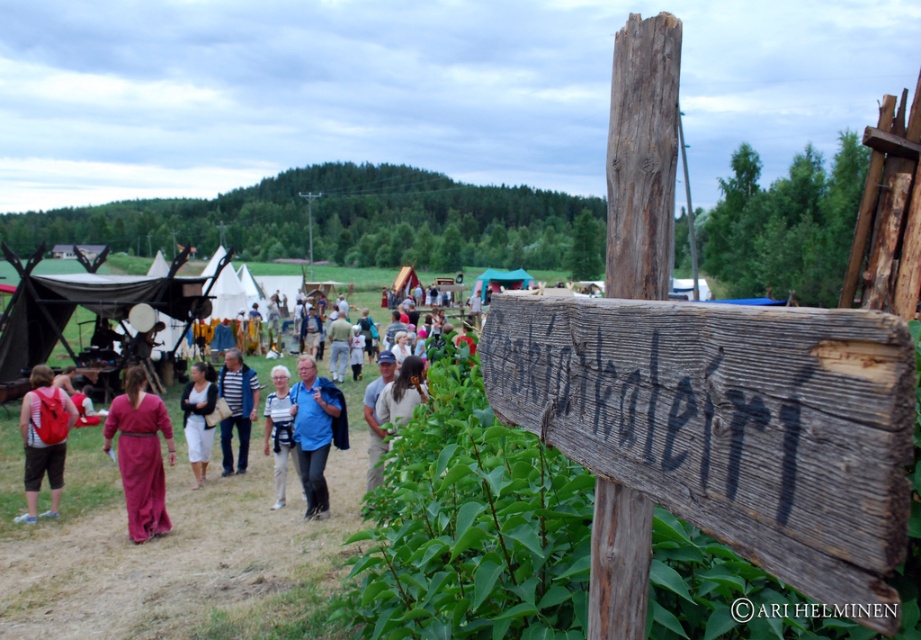
Question: Does blue fabric jacket at center appear on the right side of blue fabric shirt at center?

Choices:
 (A) no
 (B) yes

Answer: (B)

Question: Where is red backpack at left located in relation to blue fabric jacket at center in the image?

Choices:
 (A) above
 (B) below

Answer: (B)

Question: Which of the following is the closest to the observer?

Choices:
 (A) blue fabric jacket at center
 (B) weathered wood sign at center-right
 (C) red backpack at left

Answer: (B)

Question: Does matte pink dress at center have a greater width compared to red backpack at left?

Choices:
 (A) no
 (B) yes

Answer: (B)

Question: Considering the real-world distances, which object is closest to the blue fabric jacket at center?

Choices:
 (A) white cotton shirt at center
 (B) brown leather jacket at center
 (C) light brown leather jacket at center

Answer: (A)

Question: Estimate the real-world distances between objects in this image. Which object is closer to the blue fabric jacket at center?

Choices:
 (A) matte pink dress at center
 (B) blue striped shirt at center

Answer: (A)